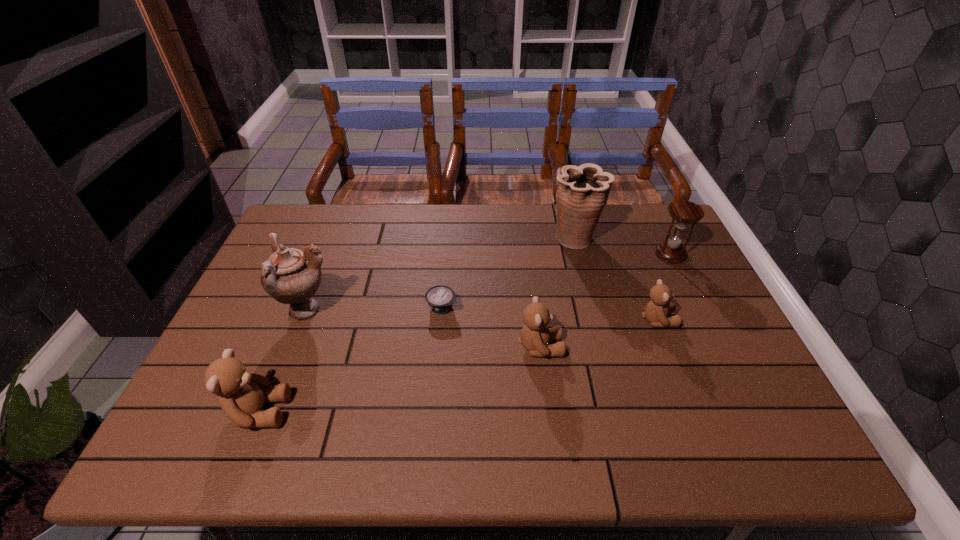
You are a GUI agent. You are given a task and a screenshot of the screen. Output one action in this format:
    pyautogui.click(x=<x>, y=<y>)
    Task: Click on the vacant spot for a new teddy_bear to ensure equal spacing
    The height and width of the screenshot is (540, 960).
    Given the screenshot: What is the action you would take?
    pyautogui.click(x=408, y=377)